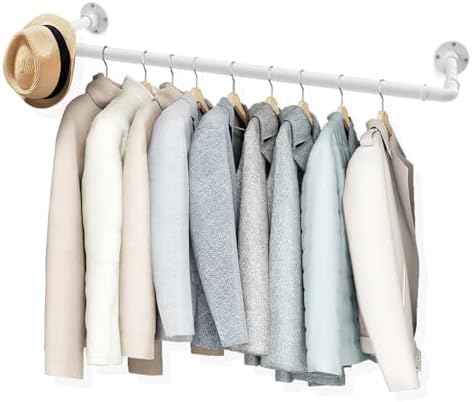
Where is `gap between coat hanger hooks on rod`? This screenshot has width=472, height=402. gap between coat hanger hooks on rod is located at coordinates (127, 61), (157, 57), (185, 63), (212, 67), (248, 71), (285, 76), (316, 82), (356, 88).